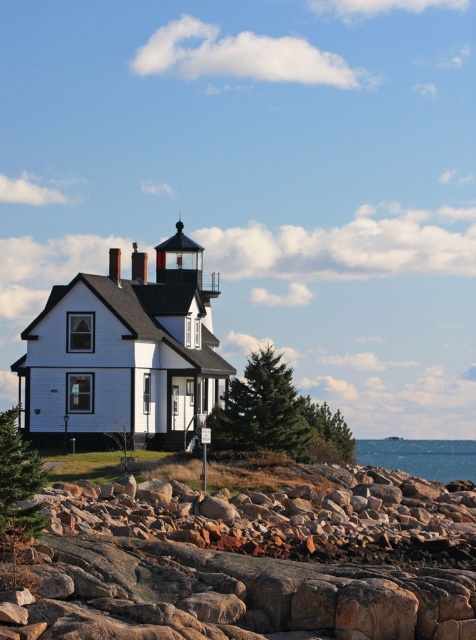
Does rockyrough texturedrocks at lower right lie in front of blue water at lower right?

Yes, rockyrough texturedrocks at lower right is closer to the viewer.

Between rockyrough texturedrocks at lower right and blue water at lower right, which one appears on the left side from the viewer's perspective?

Positioned to the left is rockyrough texturedrocks at lower right.

Is point (66, 564) positioned after point (452, 456)?

No, it is in front of (452, 456).

Locate an element on the screen. rockyrough texturedrocks at lower right is located at coordinates (243, 564).